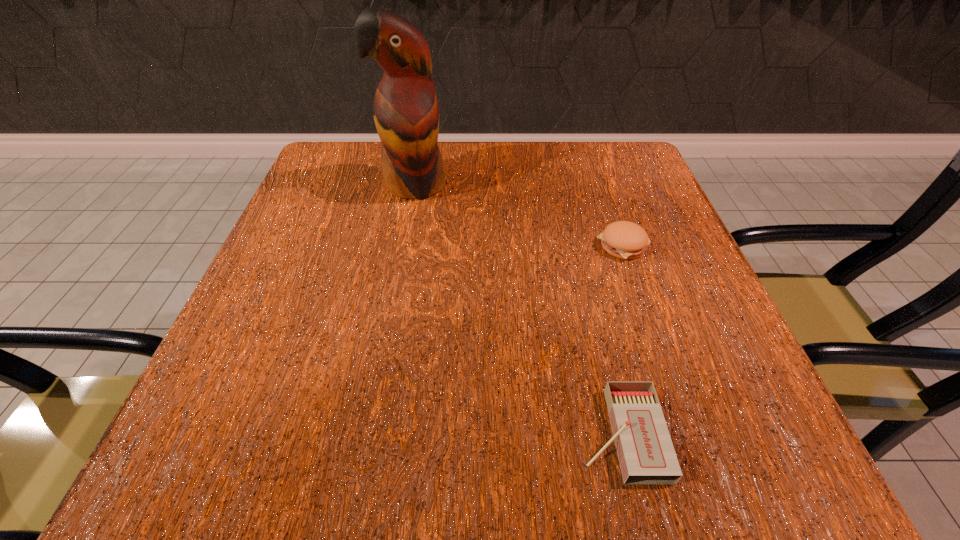
The height and width of the screenshot is (540, 960). I want to click on the tallest object, so (x=406, y=113).

What are the coordinates of `the leftmost object` in the screenshot? It's located at (406, 113).

Locate an element on the screen. Image resolution: width=960 pixels, height=540 pixels. patty is located at coordinates (626, 240).

The image size is (960, 540). Identify the location of matchbox. (646, 454).

Where is `vacant space located on the face of the tallest object`? The image size is (960, 540). vacant space located on the face of the tallest object is located at coordinates (392, 306).

The width and height of the screenshot is (960, 540). I want to click on vacant space situated on the left of the second farthest object, so click(395, 245).

I want to click on vacant space located 0.060m on the striking surface of the nearest object, so click(x=532, y=434).

At what (x,y) coordinates should I click in order to perform the action: click on vacant space positioned on the striking surface of the nearest object. Please return your answer as a coordinate pair (x, y). Looking at the image, I should click on (409, 434).

At what (x,y) coordinates should I click in order to perform the action: click on vacant space located on the striking surface of the nearest object. Please return your answer as a coordinate pair (x, y). Looking at the image, I should click on (417, 434).

The height and width of the screenshot is (540, 960). What are the coordinates of `object that is at the far edge` in the screenshot? It's located at (406, 113).